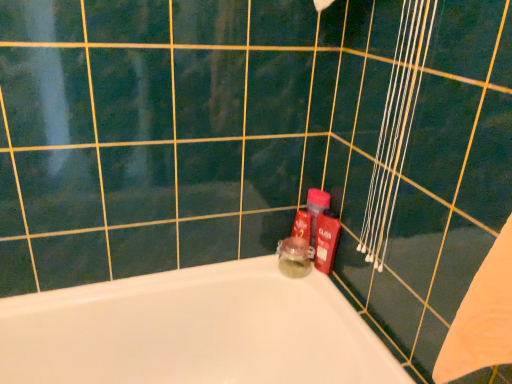
I want to click on blank space to the left of translucent glass jar at center, acting as the 1th toiletry starting from the left, so [249, 274].